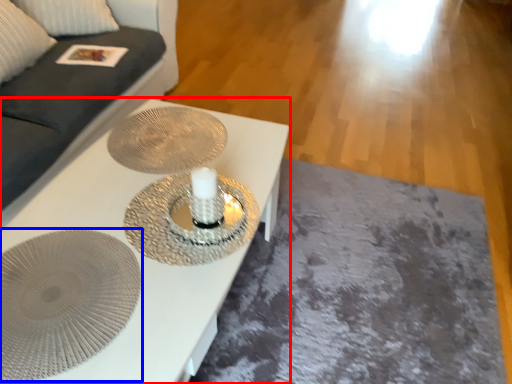
Question: Among these objects, which one is nearest to the camera, table (highlighted by a red box) or oval (highlighted by a blue box)?

Choices:
 (A) table
 (B) oval

Answer: (A)